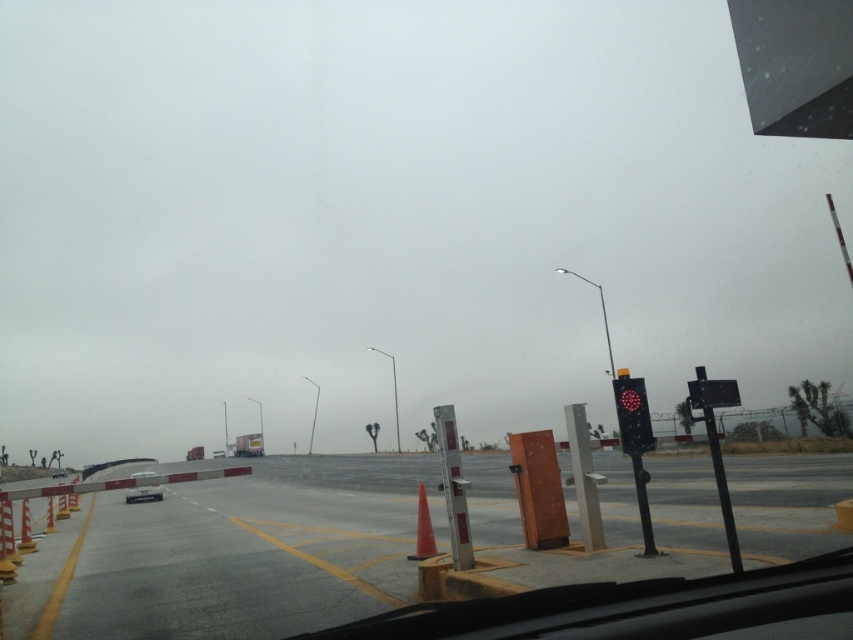
Question: Estimate the real-world distances between objects in this image. Which object is farther from the black plastic traffic light at right?

Choices:
 (A) orange matte traffic cone at center
 (B) transparent glass windshield at lower center
 (C) matte black traffic light at right
 (D) orange matte traffic cone at left

Answer: (D)

Question: Which point is closer to the camera?

Choices:
 (A) (426, 515)
 (B) (26, 552)
 (C) (49, 516)

Answer: (A)

Question: Can you confirm if smooth asphalt highway at center is smaller than orange plastic traffic cone at left?

Choices:
 (A) yes
 (B) no

Answer: (B)

Question: Which of the following is the closest to the observer?

Choices:
 (A) (724, 490)
 (B) (131, 497)

Answer: (A)

Question: In this image, where is orange matte traffic cone at center located relative to orange plastic traffic cone at left?

Choices:
 (A) below
 (B) above

Answer: (B)

Question: Does transparent glass windshield at lower center have a lesser width compared to white plastic car at center?

Choices:
 (A) no
 (B) yes

Answer: (B)